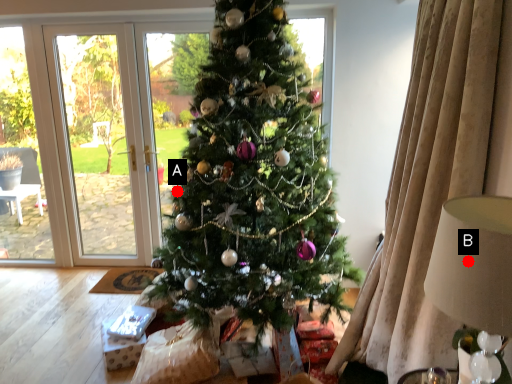
Question: Two points are circled on the image, labeled by A and B beside each circle. Which of the following is the closest to the observer?

Choices:
 (A) A is closer
 (B) B is closer

Answer: (B)